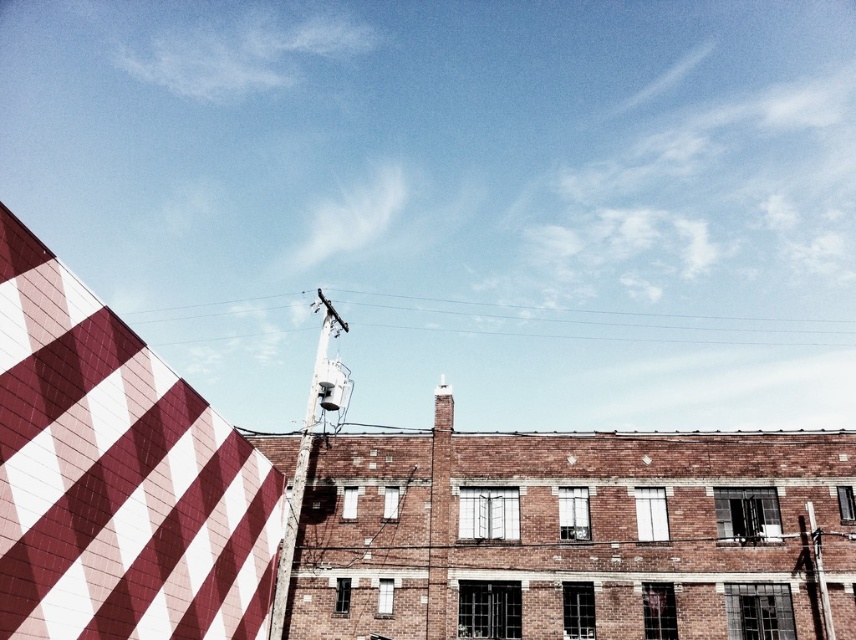
You are a painter standing at the base of the brick building. You notice the diagonal striped fabric at upper left and the metallic pole at right. Which object is closer to you?

The metallic pole at right is closer to you because the diagonal striped fabric at upper left is positioned over it, indicating it is in front.

You are standing in front of the brick building with the metallic pole at center. If you want to reach the pole quickly, should you walk towards the left side of the building or the right side?

Since the metallic pole at center is 27.75 meters from the viewer, walking towards either the left or right side of the building would not change the distance to the pole, as it is centrally located. However, the shortest path would be to walk straight towards the metallic pole at center.